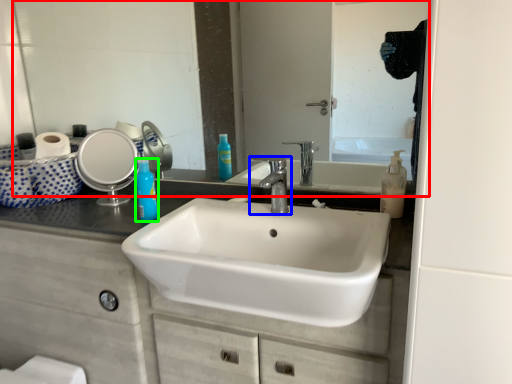
Question: Which is farther away from mirror (highlighted by a red box)? tap (highlighted by a blue box) or mouthwash (highlighted by a green box)?

Choices:
 (A) tap
 (B) mouthwash

Answer: (B)